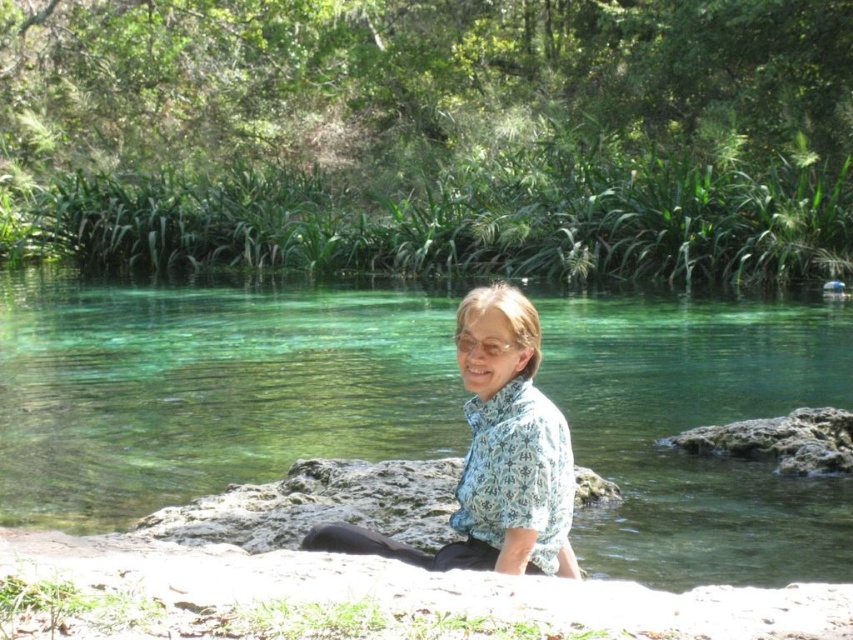
Question: Among these points, which one is nearest to the camera?

Choices:
 (A) (512, 342)
 (B) (809, 321)

Answer: (A)

Question: Is clear water at center above blue floral shirt at center?

Choices:
 (A) yes
 (B) no

Answer: (A)

Question: Which point is farther from the camera taking this photo?

Choices:
 (A) (511, 371)
 (B) (631, 502)

Answer: (B)

Question: Does clear water at center have a greater width compared to blue floral shirt at center?

Choices:
 (A) yes
 (B) no

Answer: (A)

Question: Can you confirm if clear water at center is positioned above blue floral shirt at center?

Choices:
 (A) no
 (B) yes

Answer: (B)